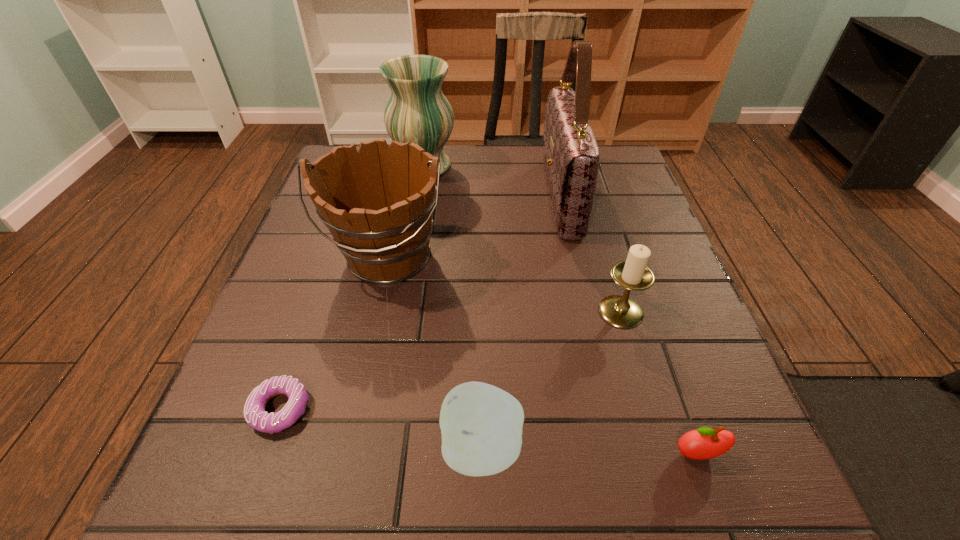
The image size is (960, 540). Identify the location of vacant space that satisfies the following two spatial constraints: 1. on the back side of the vase; 2. on the right side of the doughnut. (365, 166).